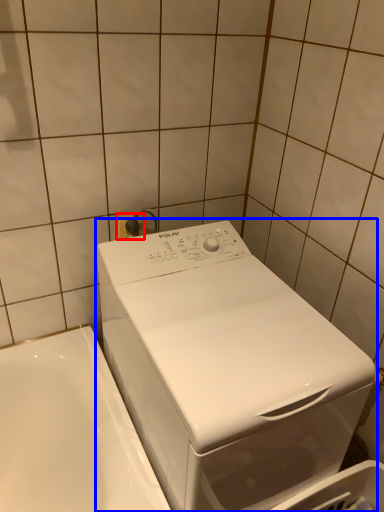
Question: Which object appears closest to the camera in this image, electric outlet (highlighted by a red box) or washing machine (highlighted by a blue box)?

Choices:
 (A) electric outlet
 (B) washing machine

Answer: (B)